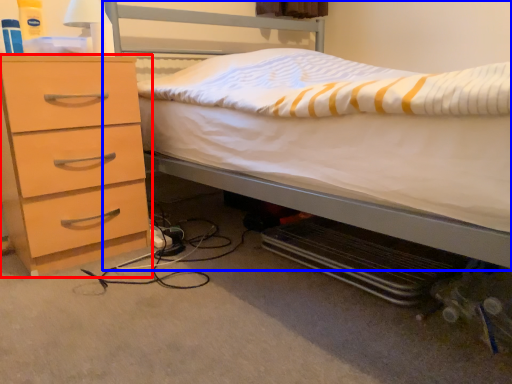
Question: Which object appears farthest to the camera in this image, chest of drawers (highlighted by a red box) or bed (highlighted by a blue box)?

Choices:
 (A) chest of drawers
 (B) bed

Answer: (A)